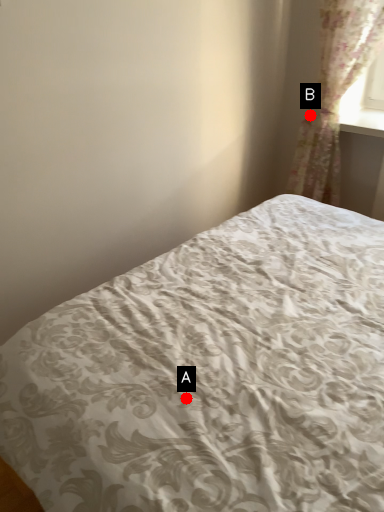
Question: Two points are circled on the image, labeled by A and B beside each circle. Which point is further to the camera?

Choices:
 (A) A is further
 (B) B is further

Answer: (B)